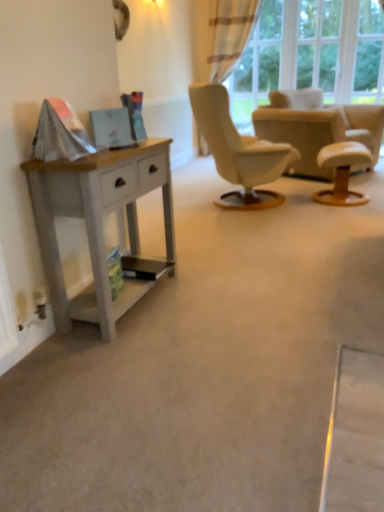
The height and width of the screenshot is (512, 384). In order to click on vacant space in front of white wood desk at left in this screenshot , I will do `click(122, 360)`.